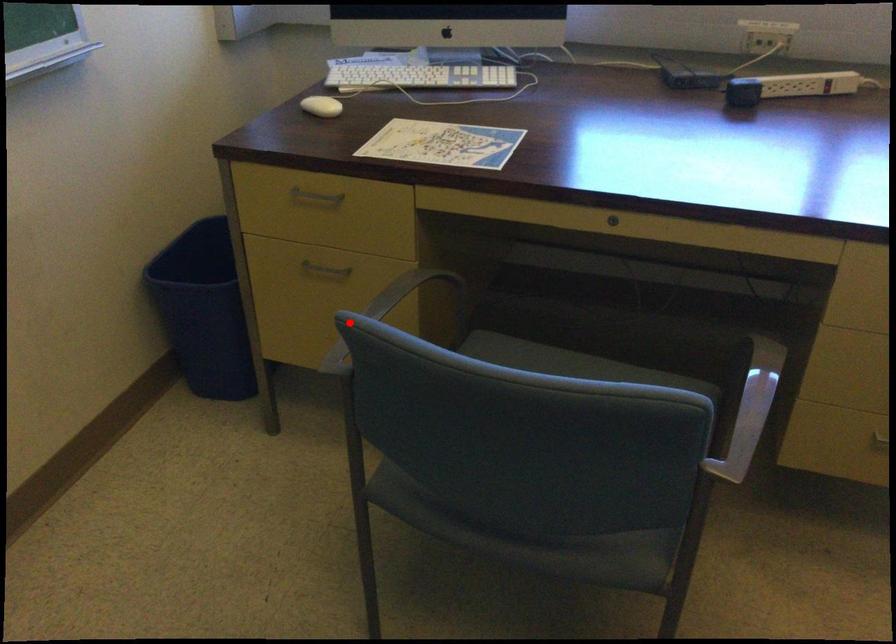
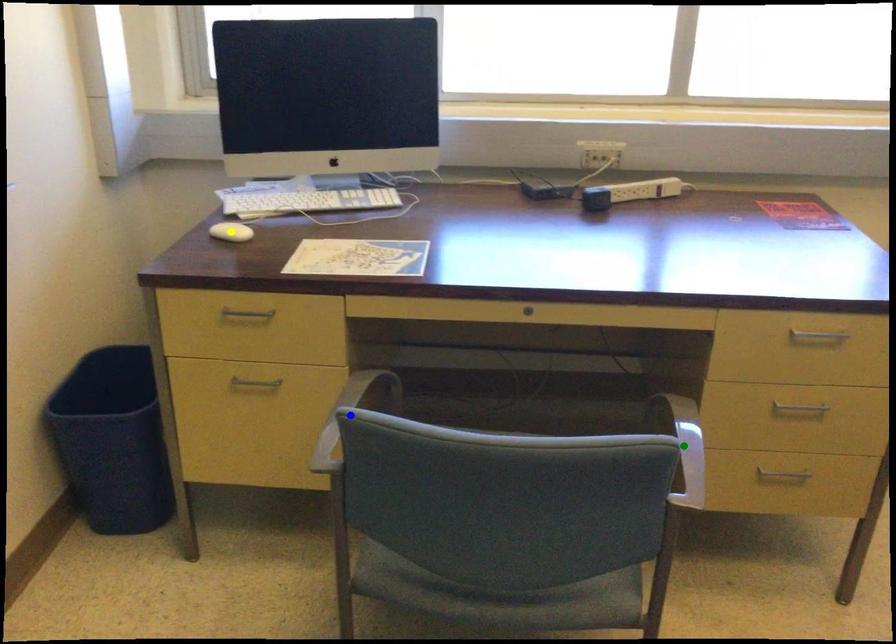
Question: I am providing you with two images of the same scene from different viewpoints. A red point is marked on the first image. You are given multiple points on the second image. Which spot in image 2 lines up with the point in image 1?

Choices:
 (A) green point
 (B) yellow point
 (C) blue point

Answer: (C)